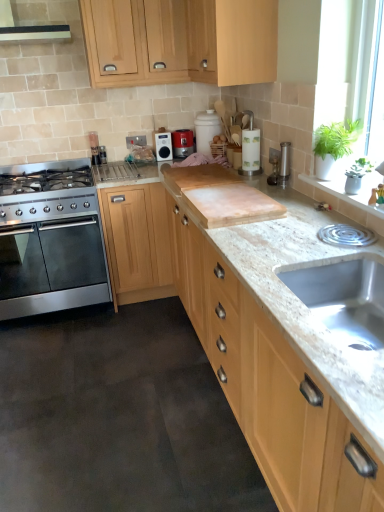
Question: In which direction should I rotate to look at matte black radio at center, arranged as the first kitchen appliance when viewed from the left?

Choices:
 (A) left
 (B) right

Answer: (A)

Question: From a real-world perspective, does metallic silver toaster at center, which is counted as the 1th kitchen appliance, starting from the right, stand above light wood cabinet at upper center, which is the first cabinetry from top to bottom?

Choices:
 (A) yes
 (B) no

Answer: (B)

Question: Is metallic silver toaster at center, the second kitchen appliance when ordered from left to right, far from light wood cabinet at upper center, the third cabinetry ordered from the bottom?

Choices:
 (A) no
 (B) yes

Answer: (A)

Question: Considering the relative sizes of metallic silver toaster at center, the second kitchen appliance when ordered from left to right, and light wood cabinet at upper center, which is the first cabinetry from top to bottom, in the image provided, is metallic silver toaster at center, the second kitchen appliance when ordered from left to right, bigger than light wood cabinet at upper center, which is the first cabinetry from top to bottom,?

Choices:
 (A) no
 (B) yes

Answer: (A)

Question: Considering the relative positions of metallic silver toaster at center, which is counted as the 1th kitchen appliance, starting from the right, and light wood cabinet at upper center, which is the first cabinetry from top to bottom, in the image provided, is metallic silver toaster at center, which is counted as the 1th kitchen appliance, starting from the right, in front of light wood cabinet at upper center, which is the first cabinetry from top to bottom,?

Choices:
 (A) no
 (B) yes

Answer: (A)

Question: Can you confirm if metallic silver toaster at center, which is counted as the 1th kitchen appliance, starting from the right, is wider than light wood cabinet at upper center, which is the first cabinetry from top to bottom?

Choices:
 (A) yes
 (B) no

Answer: (B)

Question: From the image's perspective, is metallic silver toaster at center, which is counted as the 1th kitchen appliance, starting from the right, located beneath light wood cabinet at upper center, the third cabinetry ordered from the bottom?

Choices:
 (A) yes
 (B) no

Answer: (A)

Question: Is stainless steel oven at left further to camera compared to metallic silver toaster at center, which is counted as the 1th kitchen appliance, starting from the right?

Choices:
 (A) yes
 (B) no

Answer: (B)

Question: From a real-world perspective, is stainless steel oven at left physically above metallic silver toaster at center, which is counted as the 1th kitchen appliance, starting from the right?

Choices:
 (A) no
 (B) yes

Answer: (A)

Question: Considering the relative positions of stainless steel oven at left and metallic silver toaster at center, which is counted as the 1th kitchen appliance, starting from the right, in the image provided, is stainless steel oven at left in front of metallic silver toaster at center, which is counted as the 1th kitchen appliance, starting from the right,?

Choices:
 (A) yes
 (B) no

Answer: (A)

Question: Would you say stainless steel oven at left is a long distance from metallic silver toaster at center, the second kitchen appliance when ordered from left to right?

Choices:
 (A) no
 (B) yes

Answer: (B)

Question: From a real-world perspective, is stainless steel oven at left positioned under metallic silver toaster at center, the second kitchen appliance when ordered from left to right, based on gravity?

Choices:
 (A) yes
 (B) no

Answer: (A)

Question: From the image's perspective, would you say stainless steel oven at left is positioned over metallic silver toaster at center, the second kitchen appliance when ordered from left to right?

Choices:
 (A) yes
 (B) no

Answer: (B)

Question: Does matte black radio at center, which ranks as the second kitchen appliance in right-to-left order, have a larger size compared to light wood cabinet at upper center, which is the second cabinetry from bottom to top?

Choices:
 (A) no
 (B) yes

Answer: (A)